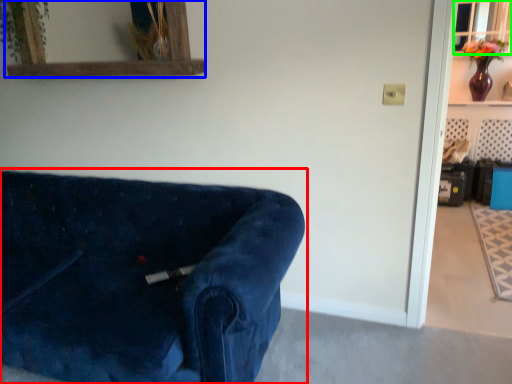
Question: Considering the real-world distances, which object is closest to studio couch (highlighted by a red box)? mirror (highlighted by a blue box) or window (highlighted by a green box).

Choices:
 (A) mirror
 (B) window

Answer: (A)